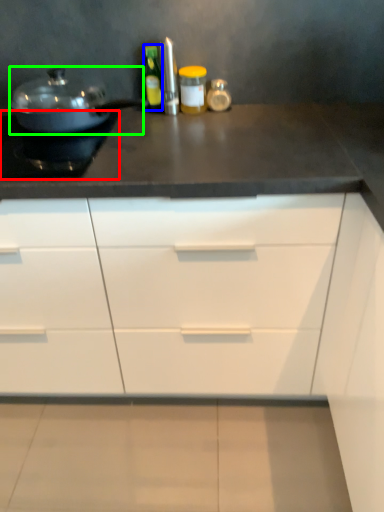
Question: Based on their relative distances, which object is nearer to appliance (highlighted by a red box)? Choose from bottle (highlighted by a blue box) and kitchen appliance (highlighted by a green box).

Choices:
 (A) bottle
 (B) kitchen appliance

Answer: (B)